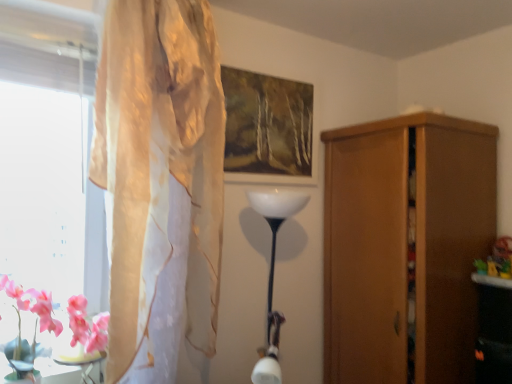
Question: Is pink silk flowers at lower left positioned far away from translucent beige curtain at left?

Choices:
 (A) yes
 (B) no

Answer: (B)

Question: Is pink silk flowers at lower left positioned with its back to translucent beige curtain at left?

Choices:
 (A) no
 (B) yes

Answer: (A)

Question: From the image's perspective, does pink silk flowers at lower left appear higher than translucent beige curtain at left?

Choices:
 (A) yes
 (B) no

Answer: (B)

Question: Could you tell me if pink silk flowers at lower left is turned towards translucent beige curtain at left?

Choices:
 (A) no
 (B) yes

Answer: (A)

Question: From a real-world perspective, does pink silk flowers at lower left stand above translucent beige curtain at left?

Choices:
 (A) yes
 (B) no

Answer: (B)

Question: Based on their sizes in the image, would you say matte wooden picture frame at upper center is bigger or smaller than wooden cupboard at right?

Choices:
 (A) big
 (B) small

Answer: (B)

Question: Is point (284, 168) positioned closer to the camera than point (413, 180)?

Choices:
 (A) farther
 (B) closer

Answer: (A)

Question: Considering the positions of matte wooden picture frame at upper center and wooden cupboard at right in the image, is matte wooden picture frame at upper center wider or thinner than wooden cupboard at right?

Choices:
 (A) thin
 (B) wide

Answer: (A)

Question: In terms of height, does matte wooden picture frame at upper center look taller or shorter compared to wooden cupboard at right?

Choices:
 (A) tall
 (B) short

Answer: (B)

Question: From a real-world perspective, is matte wooden picture frame at upper center above or below pink glossy table at lower left?

Choices:
 (A) above
 (B) below

Answer: (A)

Question: From the image's perspective, is matte wooden picture frame at upper center located above or below pink glossy table at lower left?

Choices:
 (A) above
 (B) below

Answer: (A)

Question: Choose the correct answer: Is matte wooden picture frame at upper center inside pink glossy table at lower left or outside it?

Choices:
 (A) outside
 (B) inside

Answer: (A)

Question: Is matte wooden picture frame at upper center wider or thinner than pink glossy table at lower left?

Choices:
 (A) thin
 (B) wide

Answer: (A)

Question: In the image, is translucent beige curtain at left on the left side or the right side of pink silk flowers at lower left?

Choices:
 (A) right
 (B) left

Answer: (A)

Question: Considering the positions of translucent beige curtain at left and pink silk flowers at lower left in the image, is translucent beige curtain at left wider or thinner than pink silk flowers at lower left?

Choices:
 (A) thin
 (B) wide

Answer: (B)